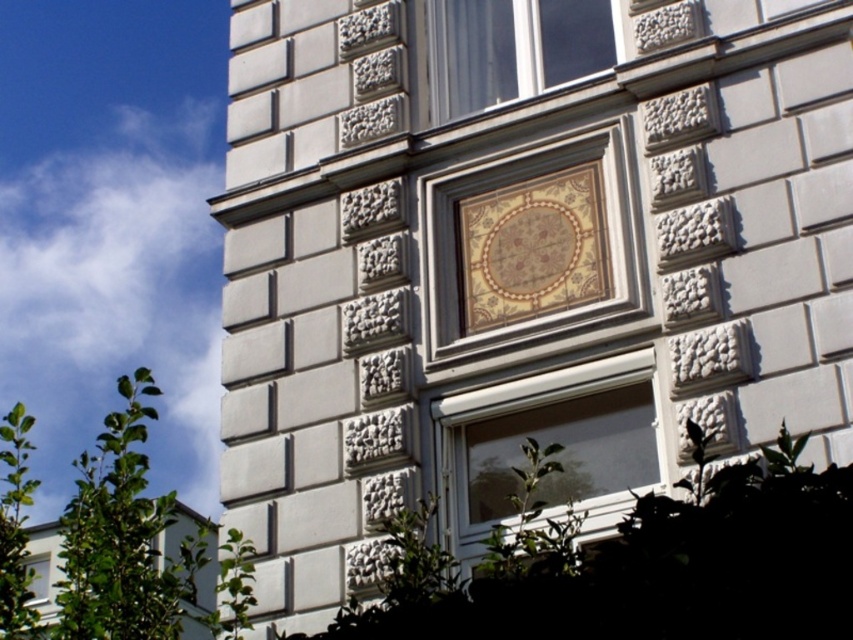
You are standing in front of the building and want to locate the clear glass window at upper center. What are its coordinates?

The clear glass window at upper center is located at coordinates point (506, 51).

In the scene shown: You are an architect examining the building facade. You notice the gold mosaic tile at center and the clear glass window at upper center. Which object is closer to you when viewed from the street?

The gold mosaic tile at center is closer to you than the clear glass window at upper center because it is in front of it.

You are standing in front of the building and notice two windows. The white plastic window at center and the clear glass window at lower left. Which window is closer to you?

The clear glass window at lower left is closer to you since it is only 10.42 meters away from the white plastic window at center, but since the question is about which is closer to you, we need to know your position. Wait, the description says the white plastic window is 10.42 meters away from the clear glass window. Without knowing the observer position, perhaps the question is flawed. Alternatively, maybe the distance between them is 10.42 meters, so the relative distance from the observer can be inferred